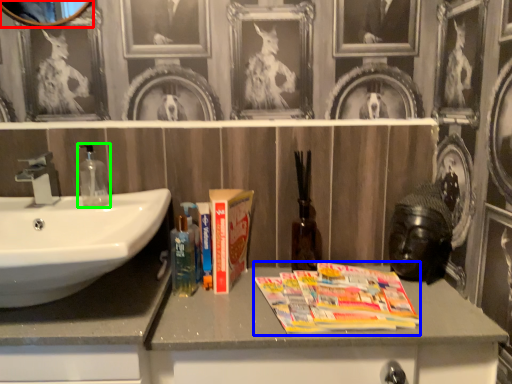
Question: Which object is positioned farthest from picture frame (highlighted by a red box)? Select from magazine (highlighted by a blue box) and soap dispenser (highlighted by a green box).

Choices:
 (A) magazine
 (B) soap dispenser

Answer: (A)